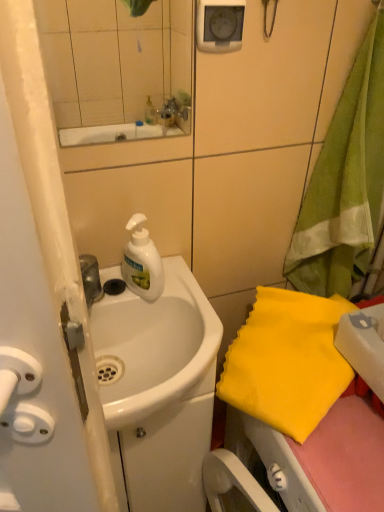
Question: Is white matte liquid soap at center further to the viewer compared to white glossy sink at center?

Choices:
 (A) no
 (B) yes

Answer: (B)

Question: Is white matte liquid soap at center to the right of white glossy sink at center from the viewer's perspective?

Choices:
 (A) no
 (B) yes

Answer: (A)

Question: From a real-world perspective, is white matte liquid soap at center located higher than white glossy sink at center?

Choices:
 (A) yes
 (B) no

Answer: (A)

Question: Is white matte liquid soap at center bigger than white glossy sink at center?

Choices:
 (A) no
 (B) yes

Answer: (A)

Question: Would you say white matte liquid soap at center contains white glossy sink at center?

Choices:
 (A) yes
 (B) no

Answer: (B)

Question: Relative to white glossy sink at center, is yellow fabric at lower right, the 2th beach towel in the top-to-bottom sequence, in front or behind?

Choices:
 (A) behind
 (B) front

Answer: (A)

Question: Based on their sizes in the image, would you say yellow fabric at lower right, the 1th beach towel positioned from the bottom, is bigger or smaller than white glossy sink at center?

Choices:
 (A) small
 (B) big

Answer: (B)

Question: Considering the positions of yellow fabric at lower right, the 1th beach towel positioned from the bottom, and white glossy sink at center in the image, is yellow fabric at lower right, the 1th beach towel positioned from the bottom, wider or thinner than white glossy sink at center?

Choices:
 (A) thin
 (B) wide

Answer: (A)

Question: Visually, is yellow fabric at lower right, the 2th beach towel in the top-to-bottom sequence, positioned to the left or to the right of white glossy sink at center?

Choices:
 (A) left
 (B) right

Answer: (B)

Question: Is point (115, 343) closer or farther from the camera than point (334, 321)?

Choices:
 (A) farther
 (B) closer

Answer: (B)

Question: Visually, is white glossy sink at center positioned to the left or to the right of yellow fabric at lower right, the 2th beach towel in the top-to-bottom sequence?

Choices:
 (A) right
 (B) left

Answer: (B)

Question: Is white glossy sink at center situated inside yellow fabric at lower right, the 2th beach towel in the top-to-bottom sequence, or outside?

Choices:
 (A) inside
 (B) outside

Answer: (B)

Question: Is white glossy sink at center in front of or behind yellow fabric at lower right, the 1th beach towel positioned from the bottom, in the image?

Choices:
 (A) behind
 (B) front

Answer: (B)

Question: In terms of width, does white glossy sink at center look wider or thinner when compared to yellow fabric at right, which is counted as the first beach towel, starting from the top?

Choices:
 (A) thin
 (B) wide

Answer: (B)

Question: From a real-world perspective, is white glossy sink at center physically located above or below yellow fabric at right, arranged as the 2th beach towel when ordered from the bottom?

Choices:
 (A) below
 (B) above

Answer: (A)